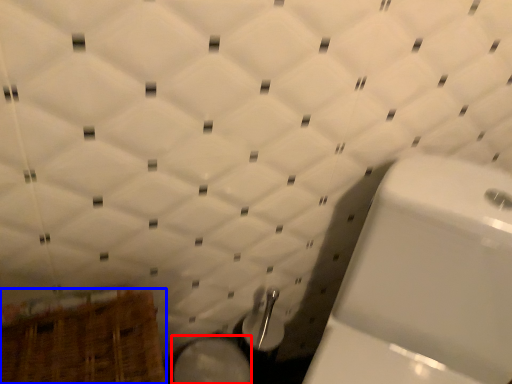
Question: Which of the following is the closest to the observer, bidet (highlighted by a red box) or basket (highlighted by a blue box)?

Choices:
 (A) bidet
 (B) basket

Answer: (B)